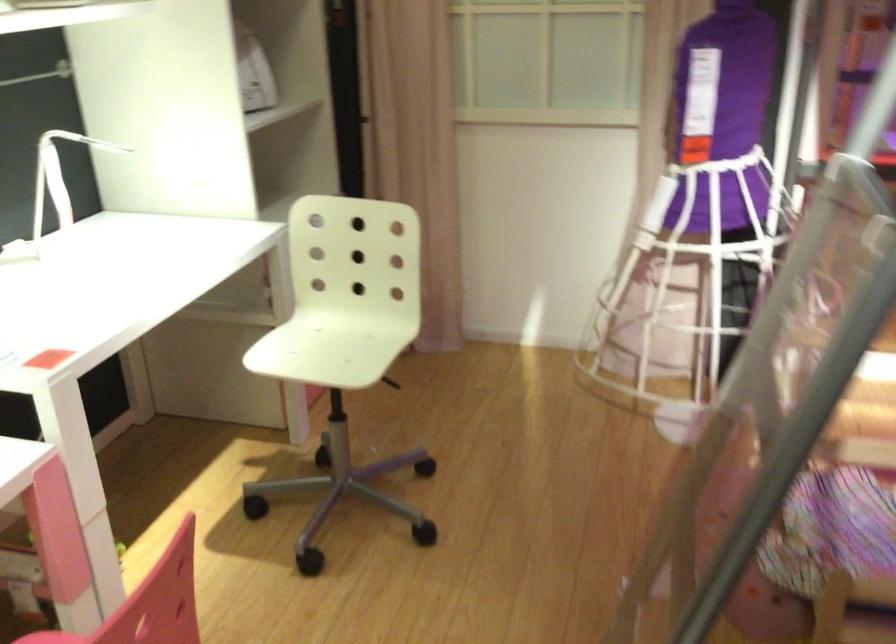
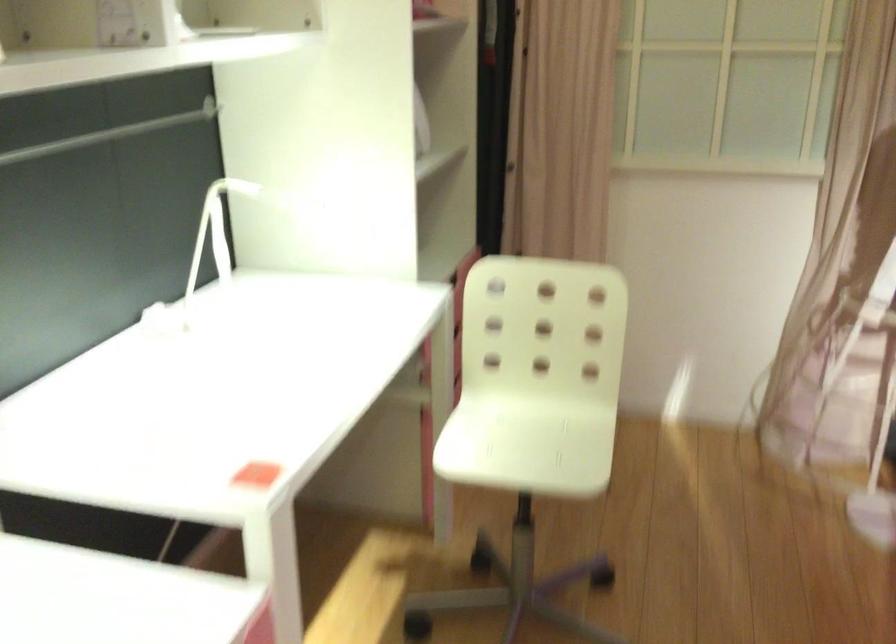
Question: How did the camera likely rotate?

Choices:
 (A) Left
 (B) Right
 (C) Up
 (D) Down

Answer: (C)